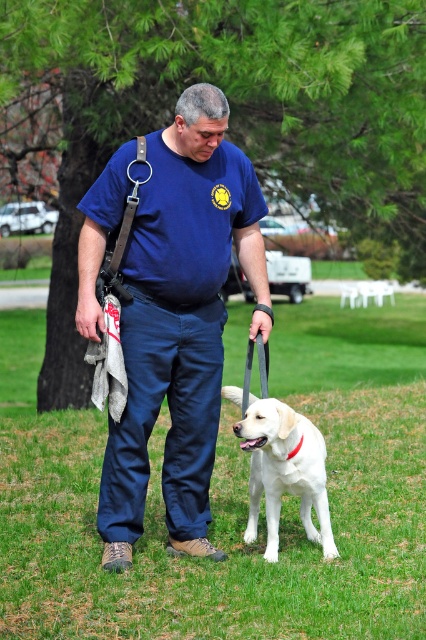
You are a photographer trying to capture a clear shot of both the man and the dog. You notice two points in the scene at coordinates point (x=199, y=305) and point (x=250, y=440). Which point is closer to the camera?

Point (x=199, y=305) is closer to the camera than point (x=250, y=440) because it is further to the camera than the latter according to the description.